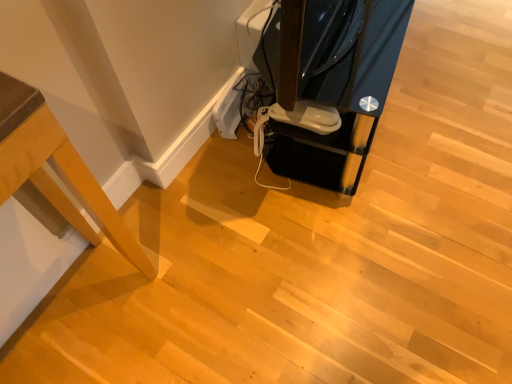
You are a GUI agent. You are given a task and a screenshot of the screen. Output one action in this format:
    pyautogui.click(x=<x>, y=<y>)
    Task: Click on the glossy black entertainment center at center
    
    Given the screenshot: What is the action you would take?
    pyautogui.click(x=329, y=82)

What do you see at coordinates (329, 82) in the screenshot?
I see `glossy black entertainment center at center` at bounding box center [329, 82].

Where is `glossy black entertainment center at center`? The image size is (512, 384). glossy black entertainment center at center is located at coordinates (329, 82).